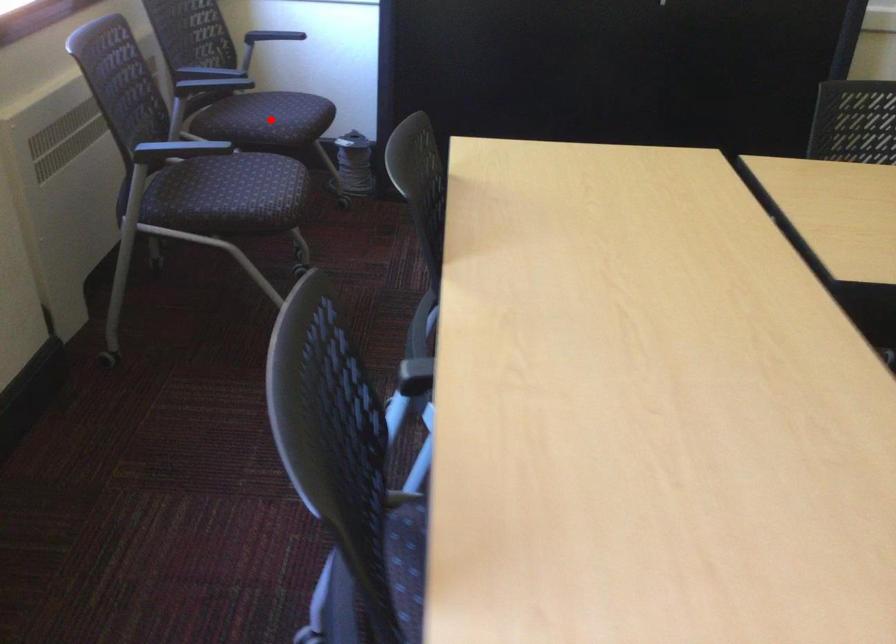
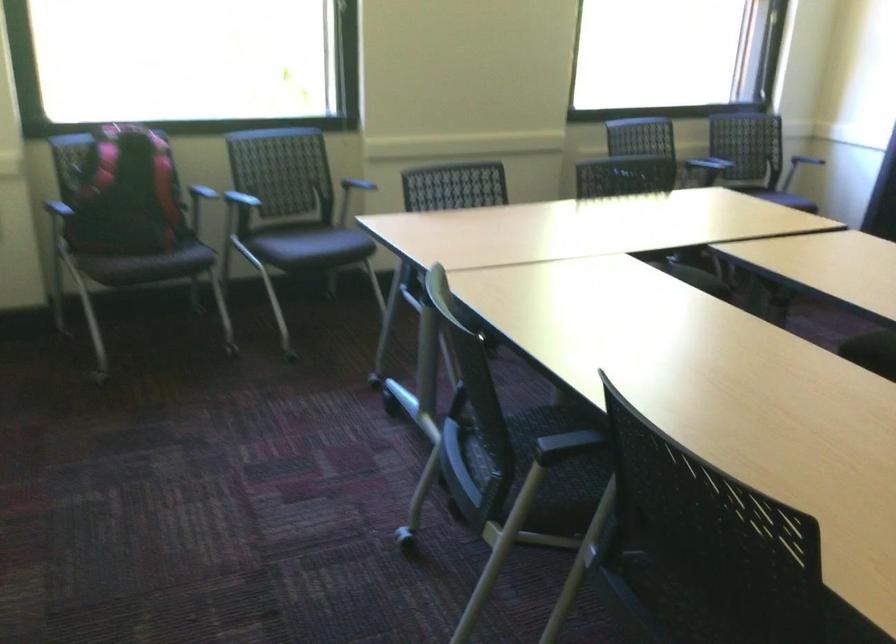
Question: I am providing you with two images of the same scene from different viewpoints. A red point is marked on the first image. At the location where the point appears in image 1, is it still visible in image 2?

Choices:
 (A) Yes
 (B) No

Answer: (B)